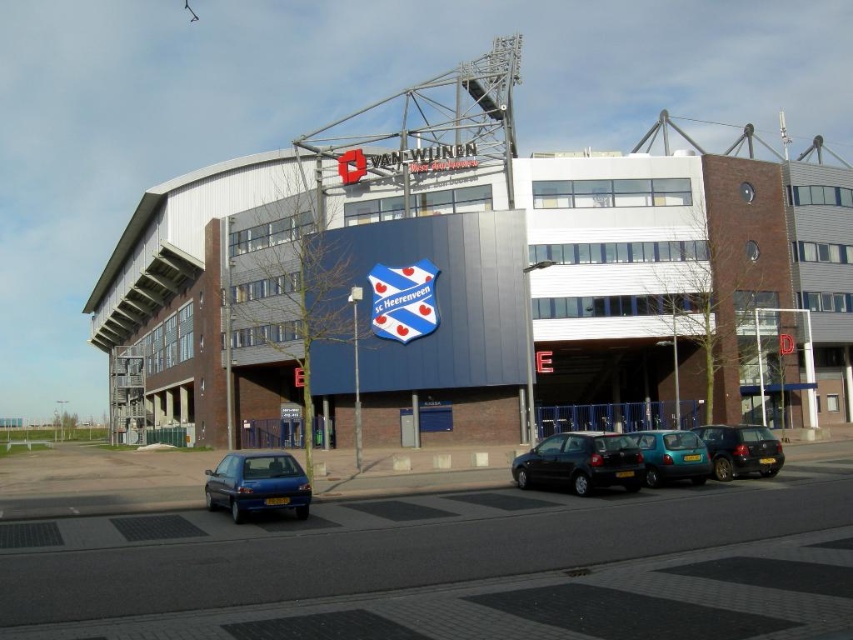
Question: Which point is closer to the camera taking this photo?

Choices:
 (A) (363, 220)
 (B) (276, 467)
 (C) (697, 468)
 (D) (711, 474)

Answer: (B)

Question: Is black matte car at center further to camera compared to black glossy hatchback at center?

Choices:
 (A) yes
 (B) no

Answer: (B)

Question: Estimate the real-world distances between objects in this image. Which object is closer to the teal matte hatchback at center?

Choices:
 (A) metallic gray stadium at center
 (B) black matte car at center

Answer: (B)

Question: Is metallic gray stadium at center to the left of teal matte hatchback at center from the viewer's perspective?

Choices:
 (A) yes
 (B) no

Answer: (A)

Question: Is metallic gray stadium at center above black glossy hatchback at center?

Choices:
 (A) yes
 (B) no

Answer: (A)

Question: Which point is closer to the camera taking this photo?

Choices:
 (A) (425, 372)
 (B) (219, 472)
 (C) (566, 433)

Answer: (B)